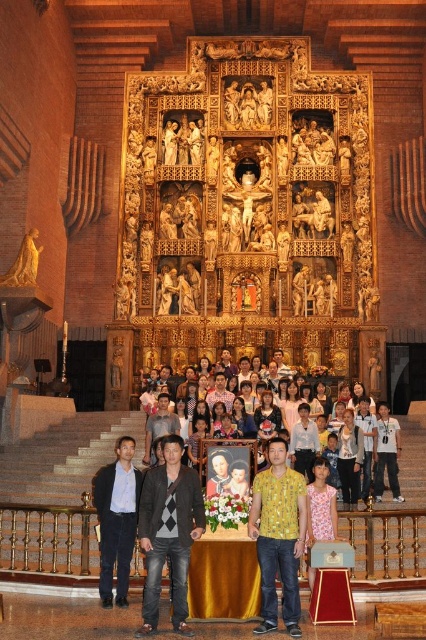
Can you confirm if yellow printed shirt at center is shorter than yellow textured shirt at center?

In fact, yellow printed shirt at center may be taller than yellow textured shirt at center.

Image resolution: width=426 pixels, height=640 pixels. I want to click on yellow printed shirt at center, so click(x=279, y=536).

Identify the location of yellow printed shirt at center. (279, 536).

Which is below, yellow printed shirt at center or light blue shirt at center?

Positioned lower is yellow printed shirt at center.

Is yellow printed shirt at center shorter than light blue shirt at center?

No.

Locate an element on the screen. yellow printed shirt at center is located at coordinates (279, 536).

Between point (103, 516) and point (356, 403), which one is positioned behind?

Point (356, 403)

This screenshot has height=640, width=426. What do you see at coordinates (117, 518) in the screenshot?
I see `dark blue suit at lower left` at bounding box center [117, 518].

The width and height of the screenshot is (426, 640). What are the coordinates of `dark blue suit at lower left` in the screenshot? It's located at (117, 518).

The height and width of the screenshot is (640, 426). What are the coordinates of `dark blue suit at lower left` in the screenshot? It's located at (117, 518).